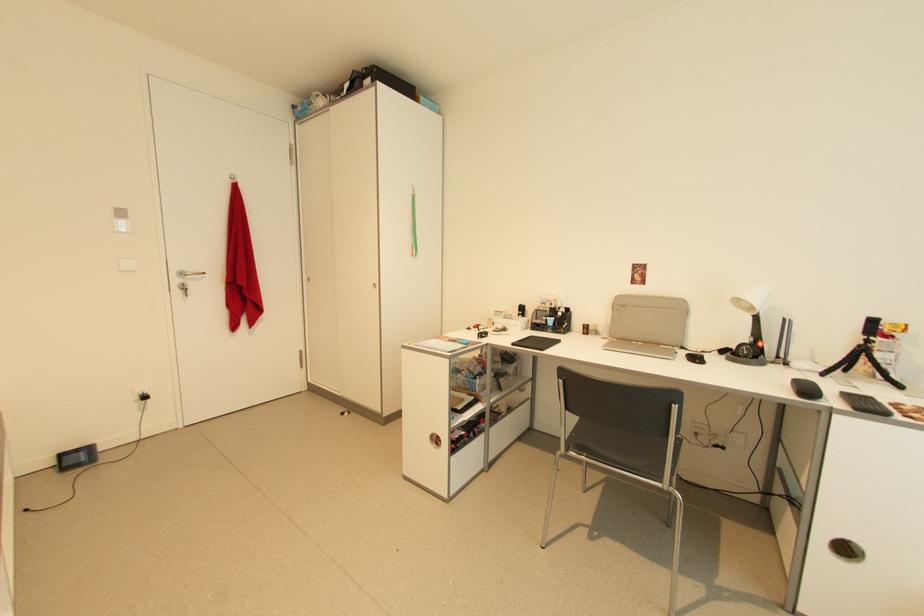
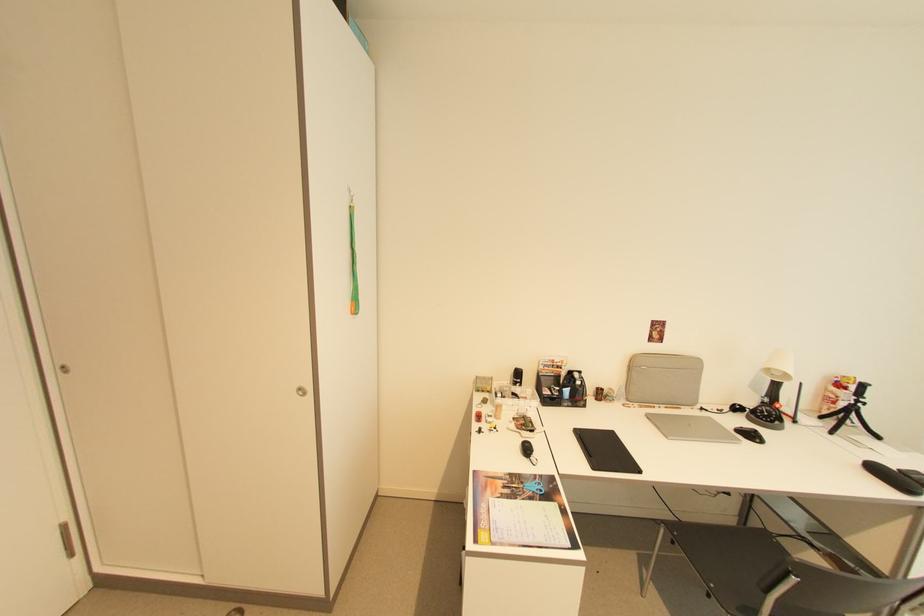
Where in the second image is the point corresponding to point 702,363 from the first image?

(762, 442)